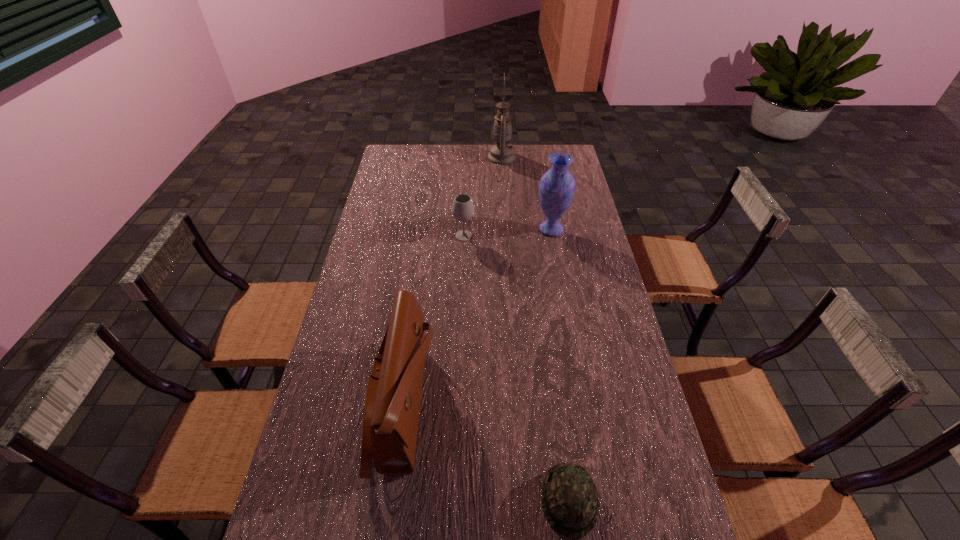
I want to click on vacant position in the image that satisfies the following two spatial constraints: 1. on the front side of the shortest object; 2. on the left side of the tallest object, so click(x=524, y=500).

You are a GUI agent. You are given a task and a screenshot of the screen. Output one action in this format:
    pyautogui.click(x=<x>, y=<y>)
    Task: Click on the free space in the image that satisfies the following two spatial constraints: 1. on the front flap of the leftmost object; 2. on the left side of the shortest object
    
    Given the screenshot: What is the action you would take?
    pyautogui.click(x=388, y=500)

The width and height of the screenshot is (960, 540). Identify the location of free space that satisfies the following two spatial constraints: 1. on the front flap of the shortest object; 2. on the left side of the satchel. (388, 500).

Locate an element on the screen. blank space that satisfies the following two spatial constraints: 1. on the back side of the shortest object; 2. on the right side of the vase is located at coordinates click(x=533, y=229).